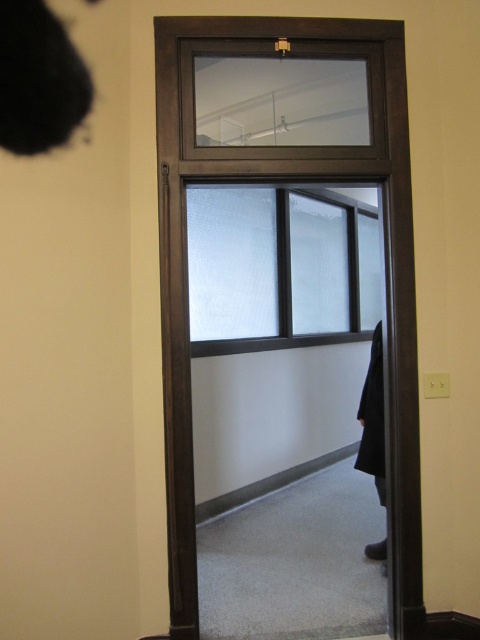
Question: Which object appears closest to the camera in this image?

Choices:
 (A) matte dark brown glass door at center
 (B) black fabric robe at right

Answer: (A)

Question: Is matte dark brown glass door at center to the left of black fabric robe at right from the viewer's perspective?

Choices:
 (A) yes
 (B) no

Answer: (A)

Question: Is matte dark brown glass door at center below black fabric robe at right?

Choices:
 (A) no
 (B) yes

Answer: (A)

Question: Estimate the real-world distances between objects in this image. Which object is farther from the frosted glass window at center?

Choices:
 (A) matte dark brown glass door at center
 (B) black fabric robe at right

Answer: (A)

Question: Among these objects, which one is nearest to the camera?

Choices:
 (A) black fabric robe at right
 (B) frosted glass window at center

Answer: (A)

Question: Is matte dark brown glass door at center positioned in front of frosted glass window at center?

Choices:
 (A) yes
 (B) no

Answer: (A)